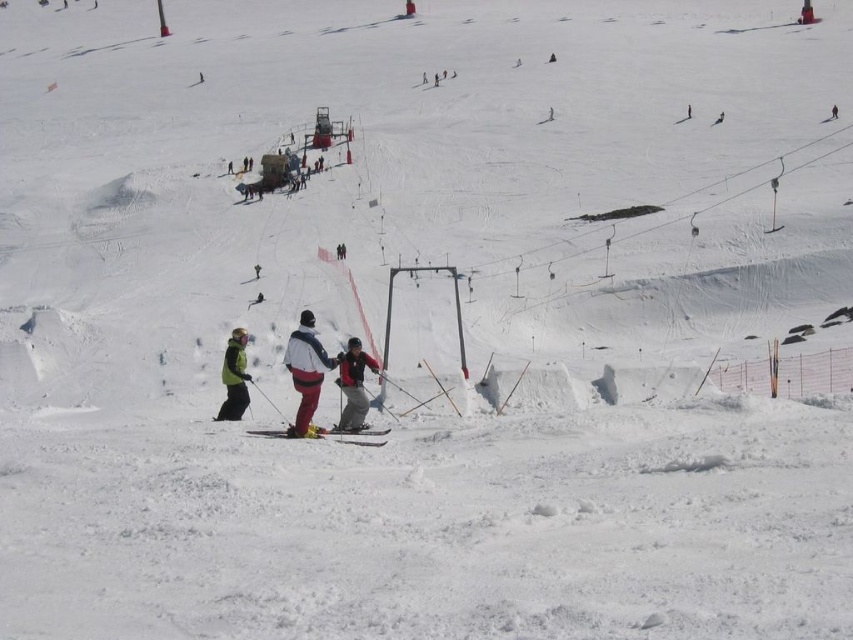
Question: Estimate the real-world distances between objects in this image. Which object is farther from the yellow matte ski at center?

Choices:
 (A) white matte jacket at center
 (B) red ski jacket at center
 (C) green matte jacket at lower left

Answer: (C)

Question: Is red ski jacket at center to the left of green matte jacket at lower left from the viewer's perspective?

Choices:
 (A) no
 (B) yes

Answer: (A)

Question: Can you confirm if white matte jacket at center is smaller than red ski jacket at center?

Choices:
 (A) yes
 (B) no

Answer: (B)

Question: Is white matte jacket at center further to the viewer compared to green matte jacket at lower left?

Choices:
 (A) yes
 (B) no

Answer: (B)

Question: Which of these objects is positioned farthest from the white matte jacket at center?

Choices:
 (A) red ski jacket at center
 (B) green matte jacket at lower left

Answer: (A)

Question: Which object is positioned farthest from the green matte jacket at lower left?

Choices:
 (A) yellow matte ski at center
 (B) white matte jacket at center

Answer: (A)